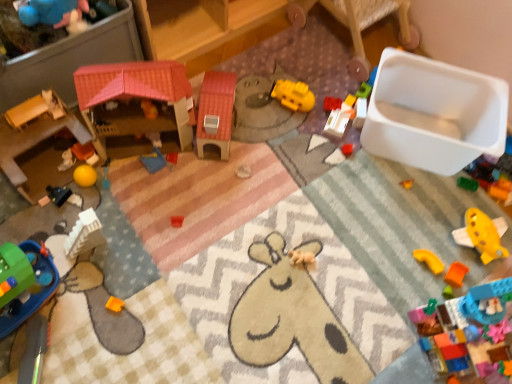
The image size is (512, 384). In order to click on free area in between yellow plastic block at upper center, which appears as the 11th toy when viewed from the left, and plastic pink house at center, the 7th toy in the left-to-right sequence in this screenshot , I will do `click(274, 128)`.